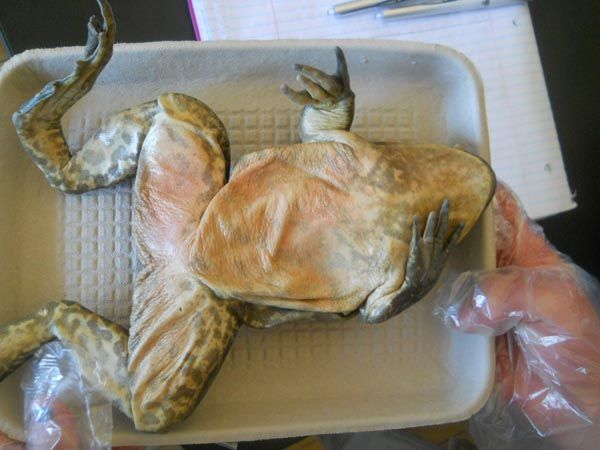
At what (x,y) coordinates should I click in order to perform the action: click on pen. Please return your answer as a coordinate pair (x, y). Looking at the image, I should click on (366, 2), (393, 12).